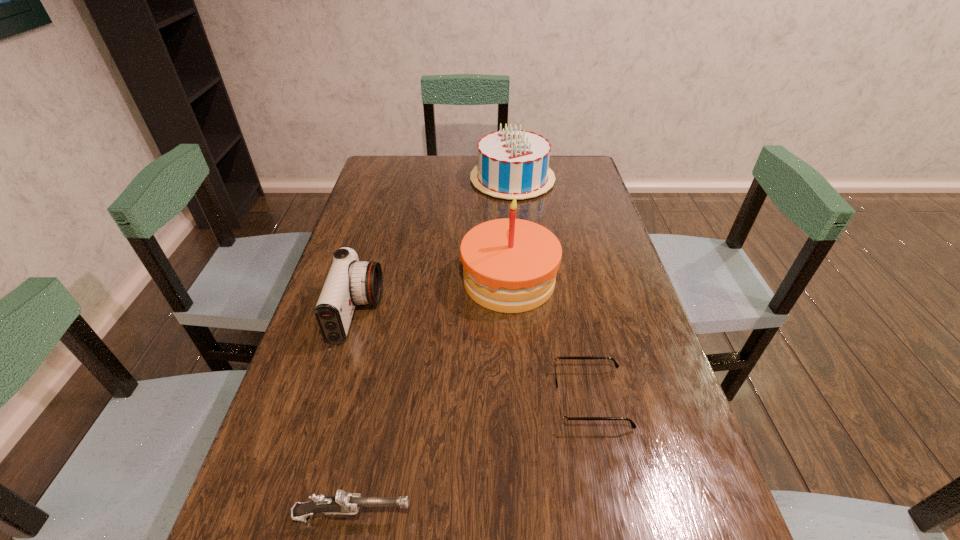
Locate an element on the screen. vacant space that is in between the gun and the farther birthday cake is located at coordinates (433, 347).

Find the location of a particular element. Image resolution: width=960 pixels, height=540 pixels. free space that is in between the farthest object and the third shortest object is located at coordinates (435, 246).

Where is `object that stands as the fourth closest to the farthest object`? object that stands as the fourth closest to the farthest object is located at coordinates 342,503.

Select which object is the fourth closest to the nearest object. Please provide its 2D coordinates. Your answer should be formatted as a tuple, i.e. [(x, y)], where the tuple contains the x and y coordinates of a point satisfying the conditions above.

[(513, 163)]

Locate an element on the screen. vacant position in the image that satisfies the following two spatial constraints: 1. on the back side of the nearer birthday cake; 2. on the right side of the farthest object is located at coordinates (502, 179).